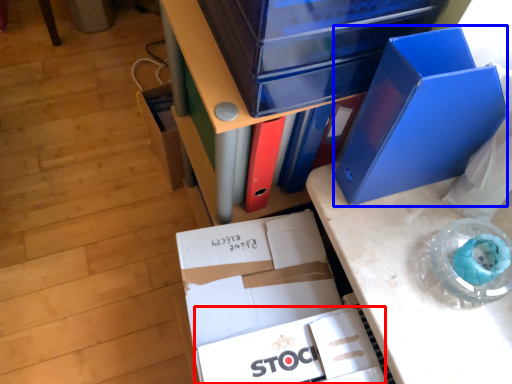
Question: Which point is closer to the camera, paperback book (highlighted by a red box) or paperback book (highlighted by a blue box)?

Choices:
 (A) paperback book
 (B) paperback book

Answer: (B)